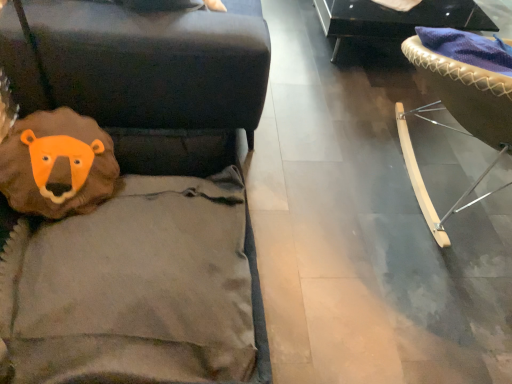
Describe the element at coordinates (395, 20) in the screenshot. I see `shiny black coffee table at upper right, which is counted as the first furniture, starting from the top` at that location.

This screenshot has height=384, width=512. Find the location of `shiny black coffee table at upper right, which is counted as the first furniture, starting from the top`. shiny black coffee table at upper right, which is counted as the first furniture, starting from the top is located at coordinates [395, 20].

What do you see at coordinates (456, 117) in the screenshot? I see `light brown leather chair at right, positioned as the first furniture in front-to-back order` at bounding box center [456, 117].

At what (x,y) coordinates should I click in order to perform the action: click on light brown leather chair at right, acting as the 1th furniture starting from the bottom. Please return your answer as a coordinate pair (x, y). This screenshot has width=512, height=384. Looking at the image, I should click on (456, 117).

Where is `shiny black coffee table at upper right, which ranks as the 1th furniture in back-to-front order`? The width and height of the screenshot is (512, 384). shiny black coffee table at upper right, which ranks as the 1th furniture in back-to-front order is located at coordinates (395, 20).

Would you say shiny black coffee table at upper right, the second furniture in the bottom-to-top sequence, is to the left or to the right of light brown leather chair at right, acting as the 1th furniture starting from the bottom, in the picture?

Clearly, shiny black coffee table at upper right, the second furniture in the bottom-to-top sequence, is on the left of light brown leather chair at right, acting as the 1th furniture starting from the bottom, in the image.

Is shiny black coffee table at upper right, the second furniture in the bottom-to-top sequence, closer to the viewer compared to light brown leather chair at right, acting as the 1th furniture starting from the bottom?

No, shiny black coffee table at upper right, the second furniture in the bottom-to-top sequence, is further to the viewer.

Which is less distant, (327, 21) or (442, 72)?

Positioned in front is point (442, 72).

From the image's perspective, is shiny black coffee table at upper right, which ranks as the 1th furniture in back-to-front order, beneath light brown leather chair at right, acting as the 2th furniture starting from the back?

No.

From a real-world perspective, is shiny black coffee table at upper right, which ranks as the second furniture in front-to-back order, on light brown leather chair at right, positioned as the first furniture in front-to-back order?

No, from a real-world perspective, shiny black coffee table at upper right, which ranks as the second furniture in front-to-back order, is not above light brown leather chair at right, positioned as the first furniture in front-to-back order.

Which of these two, shiny black coffee table at upper right, which is counted as the first furniture, starting from the top, or light brown leather chair at right, acting as the 2th furniture starting from the back, is wider?

light brown leather chair at right, acting as the 2th furniture starting from the back, is wider.

Which of these two, shiny black coffee table at upper right, which ranks as the second furniture in front-to-back order, or light brown leather chair at right, acting as the 2th furniture starting from the back, stands taller?

light brown leather chair at right, acting as the 2th furniture starting from the back.

Between shiny black coffee table at upper right, the second furniture in the bottom-to-top sequence, and light brown leather chair at right, acting as the 2th furniture starting from the back, which one has smaller size?

Smaller between the two is shiny black coffee table at upper right, the second furniture in the bottom-to-top sequence.

Is shiny black coffee table at upper right, the second furniture in the bottom-to-top sequence, spatially inside light brown leather chair at right, acting as the 1th furniture starting from the bottom, or outside of it?

shiny black coffee table at upper right, the second furniture in the bottom-to-top sequence, is outside light brown leather chair at right, acting as the 1th furniture starting from the bottom.

Is shiny black coffee table at upper right, which ranks as the 1th furniture in back-to-front order, directly adjacent to light brown leather chair at right, positioned as the first furniture in front-to-back order?

They are not placed beside each other.

Is shiny black coffee table at upper right, which ranks as the second furniture in front-to-back order, aimed at light brown leather chair at right, positioned as the first furniture in front-to-back order?

Yes.

How many degrees apart are the facing directions of shiny black coffee table at upper right, which is counted as the first furniture, starting from the top, and light brown leather chair at right, acting as the 1th furniture starting from the bottom?

The angle between the facing direction of shiny black coffee table at upper right, which is counted as the first furniture, starting from the top, and the facing direction of light brown leather chair at right, acting as the 1th furniture starting from the bottom, is 180 degrees.

Where is `furniture located on the left of light brown leather chair at right, the 2th furniture from the top`? Image resolution: width=512 pixels, height=384 pixels. furniture located on the left of light brown leather chair at right, the 2th furniture from the top is located at coordinates (395, 20).

Which object is positioned more to the right, light brown leather chair at right, positioned as the first furniture in front-to-back order, or shiny black coffee table at upper right, which ranks as the second furniture in front-to-back order?

light brown leather chair at right, positioned as the first furniture in front-to-back order, is more to the right.

Does light brown leather chair at right, acting as the 2th furniture starting from the back, lie behind shiny black coffee table at upper right, which is counted as the first furniture, starting from the top?

No, it is in front of shiny black coffee table at upper right, which is counted as the first furniture, starting from the top.

Is point (490, 168) in front of point (468, 10)?

Yes, point (490, 168) is in front of point (468, 10).

From the image's perspective, is light brown leather chair at right, the 2th furniture from the top, above or below shiny black coffee table at upper right, the second furniture in the bottom-to-top sequence?

Based on their image positions, light brown leather chair at right, the 2th furniture from the top, is located beneath shiny black coffee table at upper right, the second furniture in the bottom-to-top sequence.

From a real-world perspective, is light brown leather chair at right, the 2th furniture from the top, located beneath shiny black coffee table at upper right, which ranks as the 1th furniture in back-to-front order?

No.

Is light brown leather chair at right, positioned as the first furniture in front-to-back order, wider than shiny black coffee table at upper right, which ranks as the 1th furniture in back-to-front order?

Yes.

In the scene shown: Can you confirm if light brown leather chair at right, acting as the 2th furniture starting from the back, is shorter than shiny black coffee table at upper right, which ranks as the second furniture in front-to-back order?

In fact, light brown leather chair at right, acting as the 2th furniture starting from the back, may be taller than shiny black coffee table at upper right, which ranks as the second furniture in front-to-back order.

Is light brown leather chair at right, acting as the 1th furniture starting from the bottom, bigger than shiny black coffee table at upper right, which is counted as the first furniture, starting from the top?

Yes.

Is light brown leather chair at right, the 2th furniture from the top, spatially inside shiny black coffee table at upper right, which ranks as the second furniture in front-to-back order, or outside of it?

light brown leather chair at right, the 2th furniture from the top, is outside shiny black coffee table at upper right, which ranks as the second furniture in front-to-back order.

Does light brown leather chair at right, acting as the 1th furniture starting from the bottom, touch shiny black coffee table at upper right, which ranks as the second furniture in front-to-back order?

They are not placed beside each other.

Consider the image. Is light brown leather chair at right, acting as the 1th furniture starting from the bottom, facing away from shiny black coffee table at upper right, which is counted as the first furniture, starting from the top?

No, light brown leather chair at right, acting as the 1th furniture starting from the bottom, is not facing away from shiny black coffee table at upper right, which is counted as the first furniture, starting from the top.

Where is `furniture on the right of shiny black coffee table at upper right, which ranks as the second furniture in front-to-back order`? Image resolution: width=512 pixels, height=384 pixels. furniture on the right of shiny black coffee table at upper right, which ranks as the second furniture in front-to-back order is located at coordinates (456, 117).

Identify the location of furniture that appears above the shiny black coffee table at upper right, which ranks as the second furniture in front-to-back order (from a real-world perspective). (456, 117).

Find the location of a particular element. The width and height of the screenshot is (512, 384). furniture behind the light brown leather chair at right, the 2th furniture from the top is located at coordinates tap(395, 20).